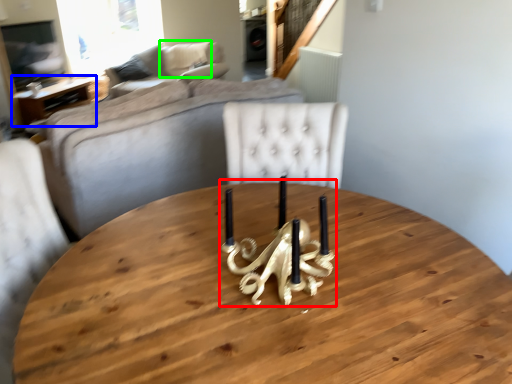
Question: Which object is the farthest from candle holder (highlighted by a red box)? Choose among these: table (highlighted by a blue box) or pillow (highlighted by a green box).

Choices:
 (A) table
 (B) pillow

Answer: (B)